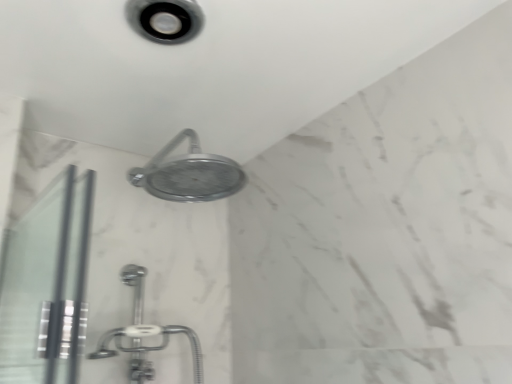
What do you see at coordinates (165, 19) in the screenshot? This screenshot has height=384, width=512. I see `white glossy light fixture at upper center` at bounding box center [165, 19].

Looking at this image, what is the approximate height of white glossy light fixture at upper center?

white glossy light fixture at upper center is 0.79 inches tall.

Locate an element on the screen. white glossy light fixture at upper center is located at coordinates (165, 19).

Locate an element on the screen. This screenshot has height=384, width=512. white glossy light fixture at upper center is located at coordinates [165, 19].